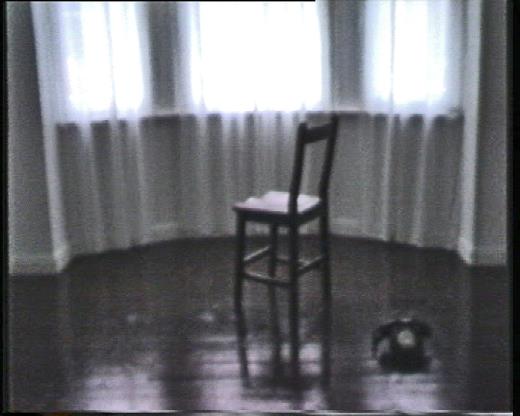
At what (x,y) coordinates should I click in order to perform the action: click on chair. Please return your answer as a coordinate pair (x, y). The height and width of the screenshot is (416, 520). Looking at the image, I should click on (289, 221).